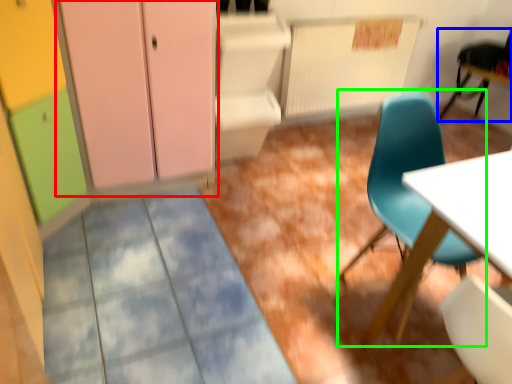
Question: Considering the real-world distances, which object is farthest from dresser (highlighted by a red box)? chair (highlighted by a blue box) or chair (highlighted by a green box)?

Choices:
 (A) chair
 (B) chair

Answer: (A)